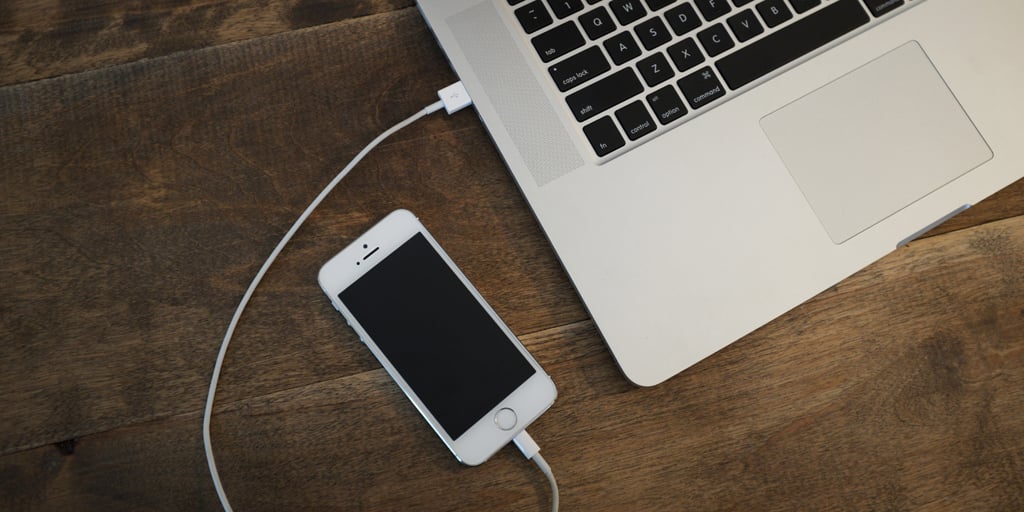
Where is `speaker`? The width and height of the screenshot is (1024, 512). speaker is located at coordinates point(538,103).